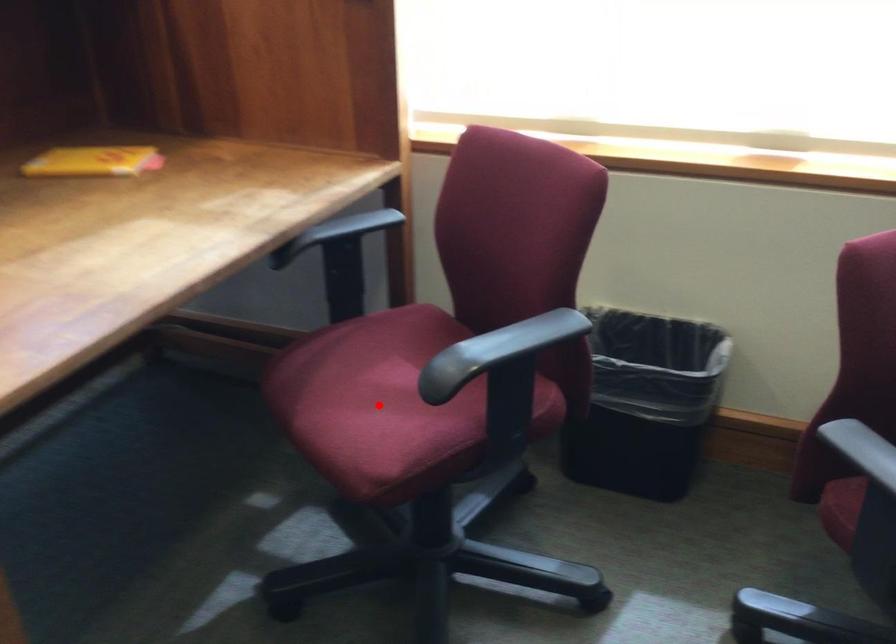
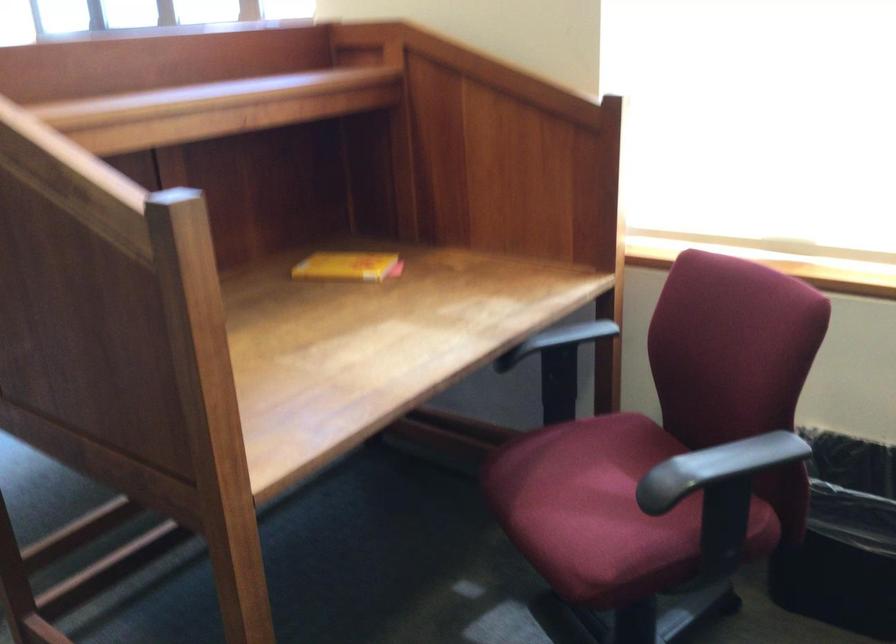
In the second image, find the point that corresponds to the highlighted location in the first image.

(592, 509)